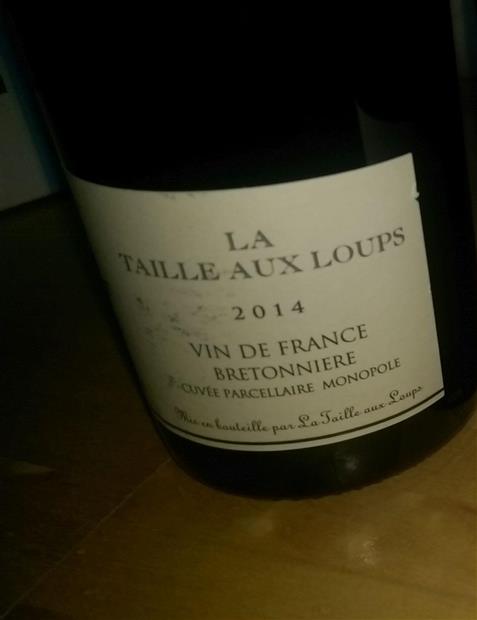
The width and height of the screenshot is (477, 620). I want to click on wine bottle to right of label, so click(439, 237).